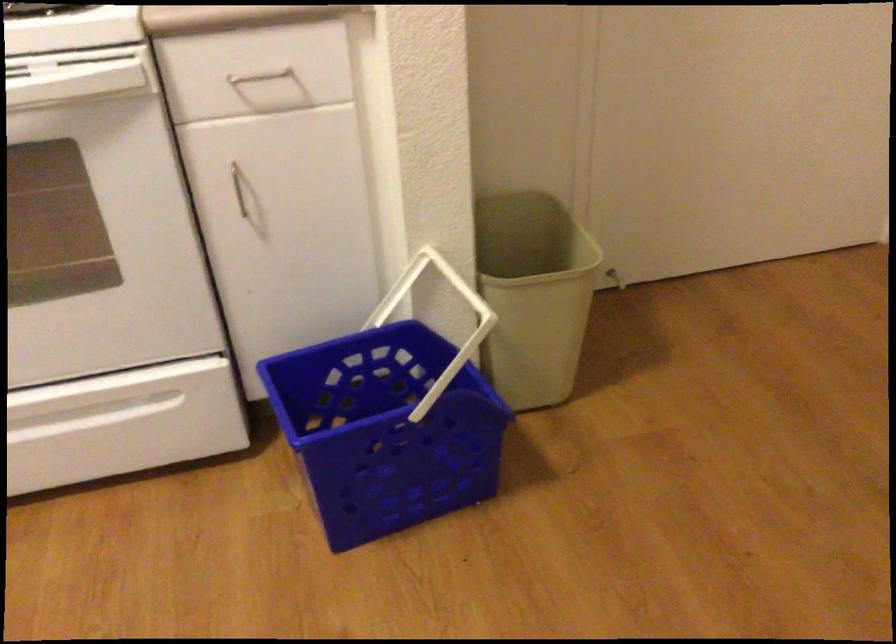
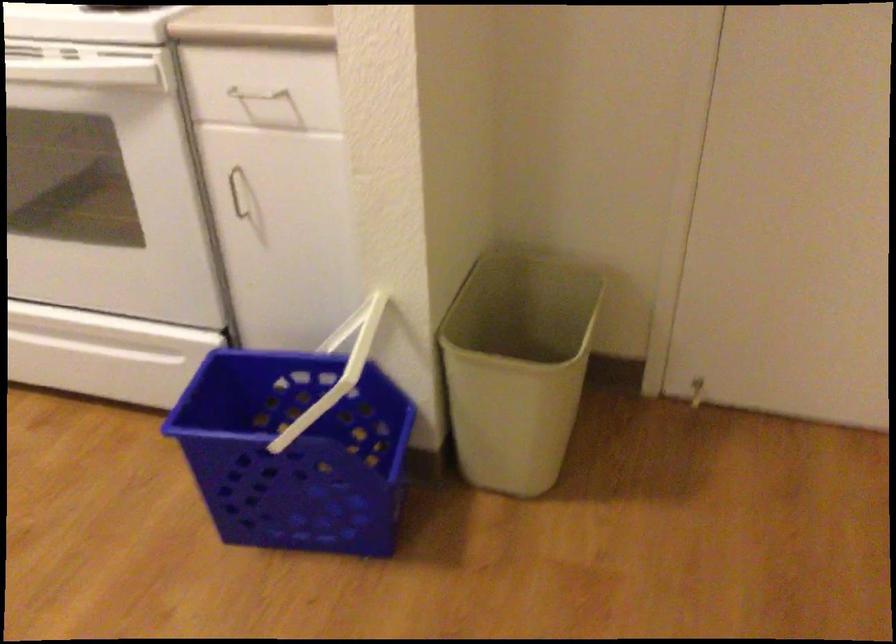
Question: How did the camera likely rotate?

Choices:
 (A) Left
 (B) Right
 (C) Up
 (D) Down

Answer: (A)